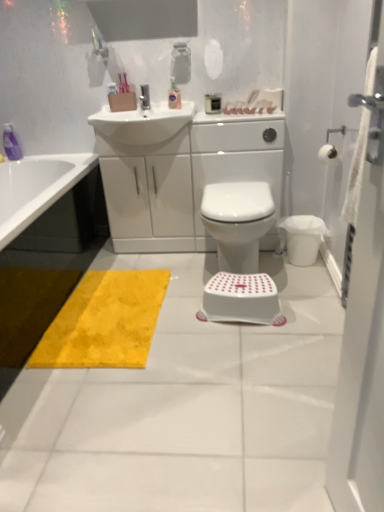
Question: From the image's perspective, is white fabric screen door at right on translucent plastic bottle at upper center?

Choices:
 (A) no
 (B) yes

Answer: (A)

Question: Does white fabric screen door at right lie in front of translucent plastic bottle at upper center?

Choices:
 (A) no
 (B) yes

Answer: (B)

Question: Is white fabric screen door at right shorter than translucent plastic bottle at upper center?

Choices:
 (A) yes
 (B) no

Answer: (B)

Question: Does white fabric screen door at right have a larger size compared to translucent plastic bottle at upper center?

Choices:
 (A) yes
 (B) no

Answer: (A)

Question: Is white fabric screen door at right touching translucent plastic bottle at upper center?

Choices:
 (A) yes
 (B) no

Answer: (B)

Question: Does point (253, 257) appear closer or farther from the camera than point (238, 313)?

Choices:
 (A) farther
 (B) closer

Answer: (A)

Question: Looking at the image, does white plastic bidet at center seem bigger or smaller compared to white plastic step stool at center?

Choices:
 (A) big
 (B) small

Answer: (A)

Question: From the image's perspective, relative to white plastic step stool at center, is white plastic bidet at center above or below?

Choices:
 (A) below
 (B) above

Answer: (B)

Question: Is white plastic bidet at center to the left or to the right of white plastic step stool at center in the image?

Choices:
 (A) right
 (B) left

Answer: (A)

Question: Is translucent plastic bottle at upper center spatially inside metallic silver faucet at upper center, or outside of it?

Choices:
 (A) inside
 (B) outside

Answer: (B)

Question: From a real-world perspective, relative to metallic silver faucet at upper center, is translucent plastic bottle at upper center vertically above or below?

Choices:
 (A) below
 (B) above

Answer: (A)

Question: From the image's perspective, is translucent plastic bottle at upper center located above or below metallic silver faucet at upper center?

Choices:
 (A) above
 (B) below

Answer: (A)

Question: Does point (172, 81) appear closer or farther from the camera than point (145, 84)?

Choices:
 (A) closer
 (B) farther

Answer: (A)

Question: Is point (377, 450) positioned closer to the camera than point (178, 99)?

Choices:
 (A) closer
 (B) farther

Answer: (A)

Question: Is white fabric screen door at right taller or shorter than translucent plastic bottle at upper center?

Choices:
 (A) short
 (B) tall

Answer: (B)